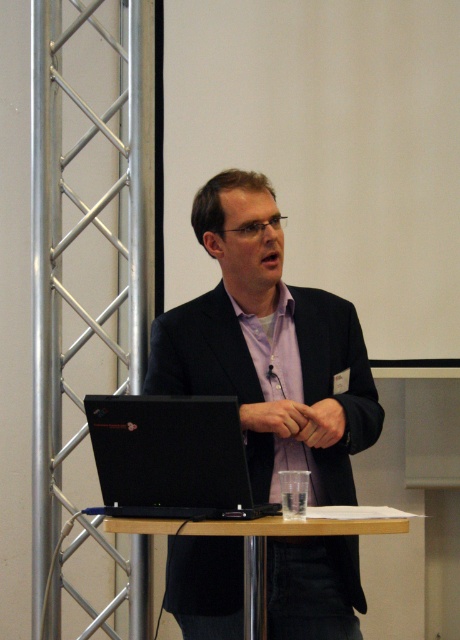
Question: Considering the relative positions of matte black suit at center and purple cotton dress shirt at center in the image provided, where is matte black suit at center located with respect to purple cotton dress shirt at center?

Choices:
 (A) below
 (B) above

Answer: (A)

Question: Estimate the real-world distances between objects in this image. Which object is closer to the black matte laptop at center?

Choices:
 (A) wooden table at center
 (B) purple cotton dress shirt at center

Answer: (A)

Question: Can you confirm if matte black suit at center is bigger than black matte laptop at center?

Choices:
 (A) yes
 (B) no

Answer: (A)

Question: Which point is farther from the camera taking this photo?

Choices:
 (A) (270, 496)
 (B) (165, 492)
 (C) (260, 518)

Answer: (A)

Question: Can you confirm if matte black suit at center is thinner than purple cotton dress shirt at center?

Choices:
 (A) no
 (B) yes

Answer: (A)

Question: Among these points, which one is farthest from the camera?

Choices:
 (A) (222, 442)
 (B) (205, 332)

Answer: (B)